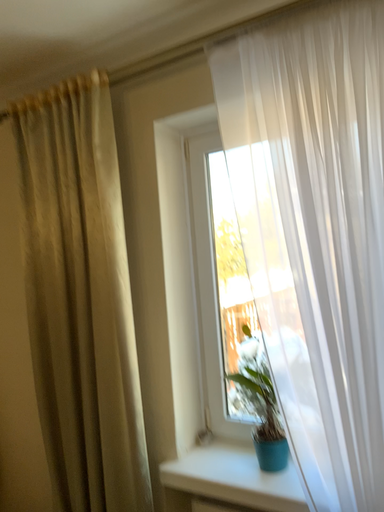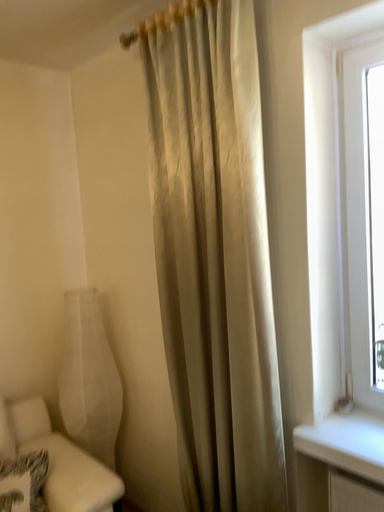
Question: How did the camera likely rotate when shooting the video?

Choices:
 (A) rotated upward
 (B) rotated downward

Answer: (B)